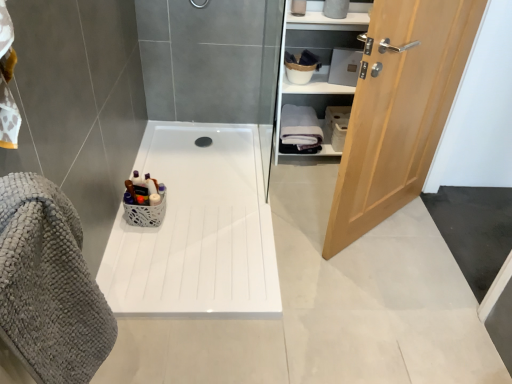
Question: Is black rubber drain at center next to white glossy cabinet at upper right and touching it?

Choices:
 (A) yes
 (B) no

Answer: (B)

Question: Does black rubber drain at center come behind white glossy cabinet at upper right?

Choices:
 (A) yes
 (B) no

Answer: (A)

Question: From the image's perspective, is black rubber drain at center above white glossy cabinet at upper right?

Choices:
 (A) no
 (B) yes

Answer: (A)

Question: Is there a large distance between black rubber drain at center and white glossy cabinet at upper right?

Choices:
 (A) yes
 (B) no

Answer: (B)

Question: Is black rubber drain at center bigger than white glossy cabinet at upper right?

Choices:
 (A) no
 (B) yes

Answer: (A)

Question: Is point (339, 163) closer or farther from the camera than point (303, 137)?

Choices:
 (A) farther
 (B) closer

Answer: (B)

Question: Do you think light wood door at right is within white cotton bath towel at right, which ranks as the 1th bath towel in back-to-front order, or outside of it?

Choices:
 (A) inside
 (B) outside

Answer: (B)

Question: Looking at the image, does light wood door at right seem bigger or smaller compared to white cotton bath towel at right, which is counted as the 2th bath towel, starting from the bottom?

Choices:
 (A) big
 (B) small

Answer: (A)

Question: In terms of height, does light wood door at right look taller or shorter compared to white cotton bath towel at right, which is counted as the 2th bath towel, starting from the bottom?

Choices:
 (A) short
 (B) tall

Answer: (B)

Question: Is white glossy bath at center wider or thinner than light wood door at right?

Choices:
 (A) wide
 (B) thin

Answer: (A)

Question: From the image's perspective, is white glossy bath at center positioned above or below light wood door at right?

Choices:
 (A) above
 (B) below

Answer: (B)

Question: Relative to light wood door at right, is white glossy bath at center in front or behind?

Choices:
 (A) front
 (B) behind

Answer: (B)

Question: From a real-world perspective, relative to light wood door at right, is white glossy bath at center vertically above or below?

Choices:
 (A) below
 (B) above

Answer: (A)

Question: From a real-world perspective, is gray textured bath towel at left, which appears as the second bath towel when viewed from the back, positioned above or below white glossy bath at center?

Choices:
 (A) above
 (B) below

Answer: (A)

Question: Choose the correct answer: Is gray textured bath towel at left, the 1th bath towel when ordered from bottom to top, inside white glossy bath at center or outside it?

Choices:
 (A) outside
 (B) inside

Answer: (A)